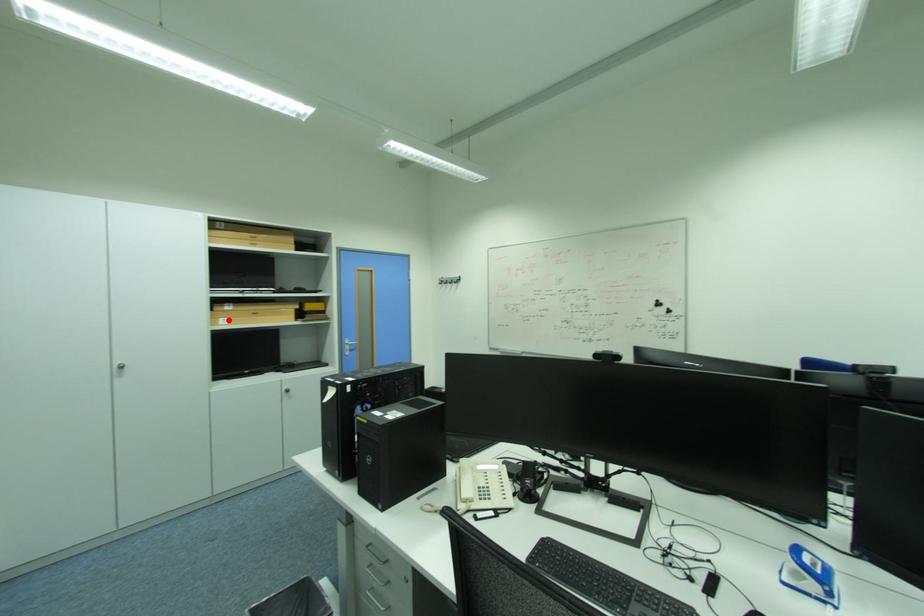
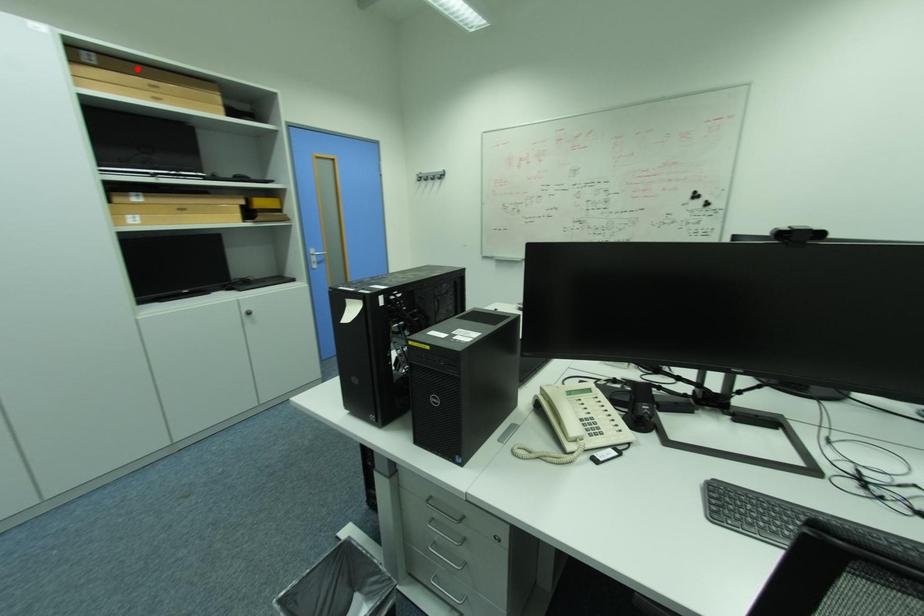
I am providing you with two images of the same scene from different viewpoints. A red point is marked on the first image and another point is marked on the second image. Does the point marked in image1 correspond to the same location as the one in image2?

No